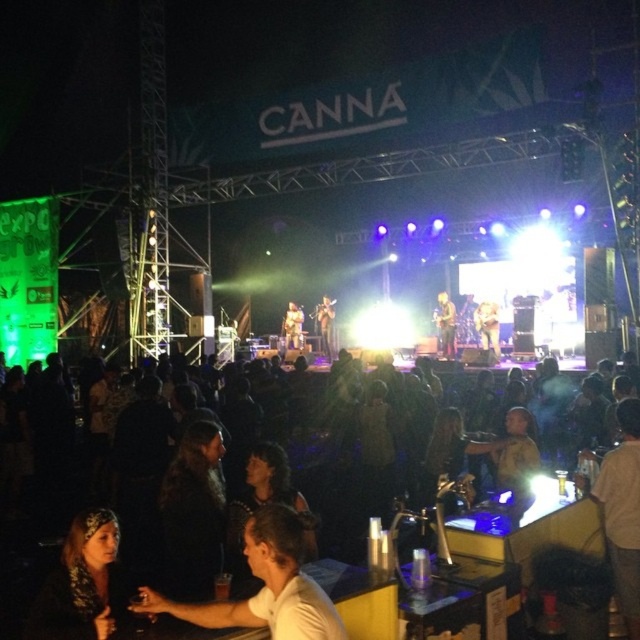
Who is positioned more to the right, white matte shirt at lower center or matte wood guitar at center?

Positioned to the right is white matte shirt at lower center.

Is white matte shirt at lower center taller than matte wood guitar at center?

Incorrect, white matte shirt at lower center's height is not larger of matte wood guitar at center's.

Does point (282, 632) come closer to viewer compared to point (292, 328)?

Yes, it is.

Locate an element on the screen. white matte shirt at lower center is located at coordinates (264, 586).

Does white matte shirt at lower center have a greater width compared to matte black microphone at center?

Correct, the width of white matte shirt at lower center exceeds that of matte black microphone at center.

Who is positioned more to the right, white matte shirt at lower center or matte black microphone at center?

Positioned to the right is matte black microphone at center.

The image size is (640, 640). I want to click on white matte shirt at lower center, so tap(264, 586).

Where is `white matte shirt at lower center`? white matte shirt at lower center is located at coordinates (264, 586).

Does point (276, 595) come in front of point (438, 324)?

Yes, point (276, 595) is closer to viewer.

Is white matte shirt at lower center wider than shiny gold guitar at center?

Correct, the width of white matte shirt at lower center exceeds that of shiny gold guitar at center.

This screenshot has height=640, width=640. What do you see at coordinates (264, 586) in the screenshot?
I see `white matte shirt at lower center` at bounding box center [264, 586].

The width and height of the screenshot is (640, 640). Identify the location of white matte shirt at lower center. (264, 586).